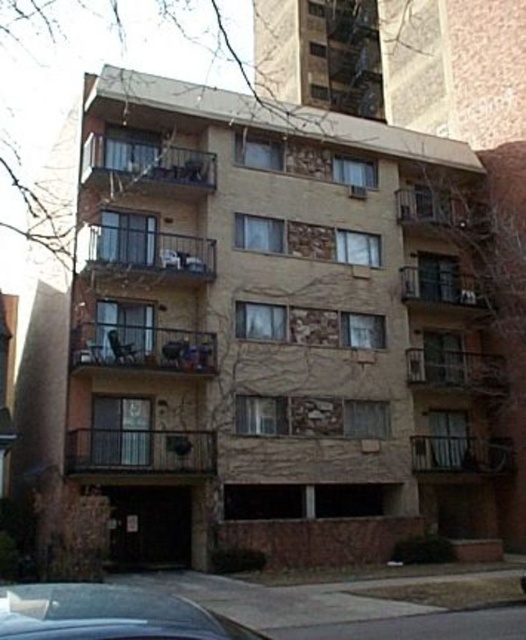
Does rustic stone balcony at center have a lesser height compared to stone textured balcony at lower right?

Indeed, rustic stone balcony at center has a lesser height compared to stone textured balcony at lower right.

Is rustic stone balcony at center taller than stone textured balcony at lower right?

Incorrect, rustic stone balcony at center's height is not larger of stone textured balcony at lower right's.

You are a GUI agent. You are given a task and a screenshot of the screen. Output one action in this format:
    pyautogui.click(x=<x>, y=<y>)
    Task: Click on the rustic stone balcony at center
    This screenshot has width=526, height=640.
    Given the screenshot: What is the action you would take?
    pyautogui.click(x=143, y=348)

Locate an element on the screen. rustic stone balcony at center is located at coordinates (143, 348).

Who is higher up, dark brown stone balcony at center or metallic silver balcony at center?

metallic silver balcony at center is higher up.

Consider the image. Is dark brown stone balcony at center bigger than metallic silver balcony at center?

Actually, dark brown stone balcony at center might be smaller than metallic silver balcony at center.

The height and width of the screenshot is (640, 526). Identify the location of dark brown stone balcony at center. (139, 451).

Can you confirm if brown stone balcony at upper center is smaller than wooden balcony at center?

Actually, brown stone balcony at upper center might be larger than wooden balcony at center.

Is brown stone balcony at upper center thinner than wooden balcony at center?

In fact, brown stone balcony at upper center might be wider than wooden balcony at center.

Does point (488, 224) come farther from viewer compared to point (437, 368)?

That is True.

Locate an element on the screen. brown stone balcony at upper center is located at coordinates (442, 209).